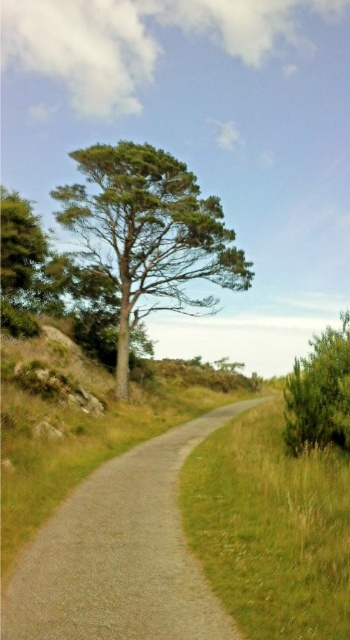
You are a hiker walking along the gravel path in the rural scene. You notice two green matte trees ahead. Which tree, the green matte tree at center or the green matte tree at left, would appear larger in your view?

The green matte tree at center would appear larger in your view because it is much taller than the green matte tree at left.

You are a hiker carrying a heavy backpack and need to walk along the gravel road at center. There is a green leafy bush at right nearby. Which path has more space for you to walk comfortably?

The gravel road at center has a lesser width compared to the green leafy bush at right, so the green leafy bush at right has more space for comfortable walking.